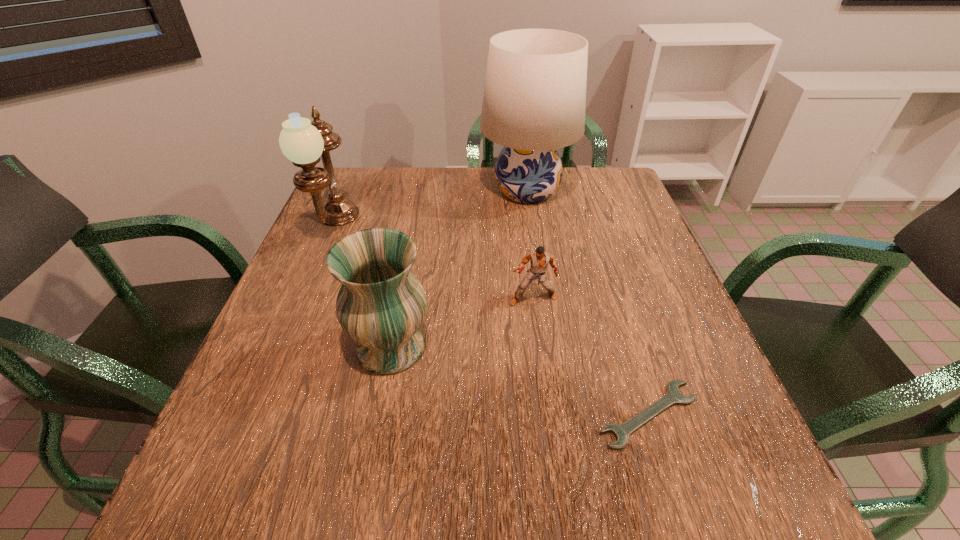
At what (x,y) coordinates should I click in order to perform the action: click on free space that satisfies the following two spatial constraints: 1. on the front-facing side of the third farthest object; 2. on the left side of the wrench. Please return your answer as a coordinate pair (x, y). Looking at the image, I should click on (548, 415).

Where is `vacant space that satisfies the following two spatial constraints: 1. on the front-facing side of the tallest object; 2. on the back side of the nearest object`? This screenshot has width=960, height=540. vacant space that satisfies the following two spatial constraints: 1. on the front-facing side of the tallest object; 2. on the back side of the nearest object is located at coordinates (560, 415).

Identify the location of free spot that satisfies the following two spatial constraints: 1. on the front-facing side of the second shortest object; 2. on the right side of the nearest object. The height and width of the screenshot is (540, 960). (548, 415).

This screenshot has width=960, height=540. In order to click on vacant area that satisfies the following two spatial constraints: 1. on the front-facing side of the second shortest object; 2. on the right side of the shortest object in this screenshot , I will do `click(548, 415)`.

At what (x,y) coordinates should I click in order to perform the action: click on vacant region that satisfies the following two spatial constraints: 1. on the front-facing side of the shortest object; 2. on the right side of the puncher. Please return your answer as a coordinate pair (x, y). This screenshot has height=540, width=960. Looking at the image, I should click on (548, 415).